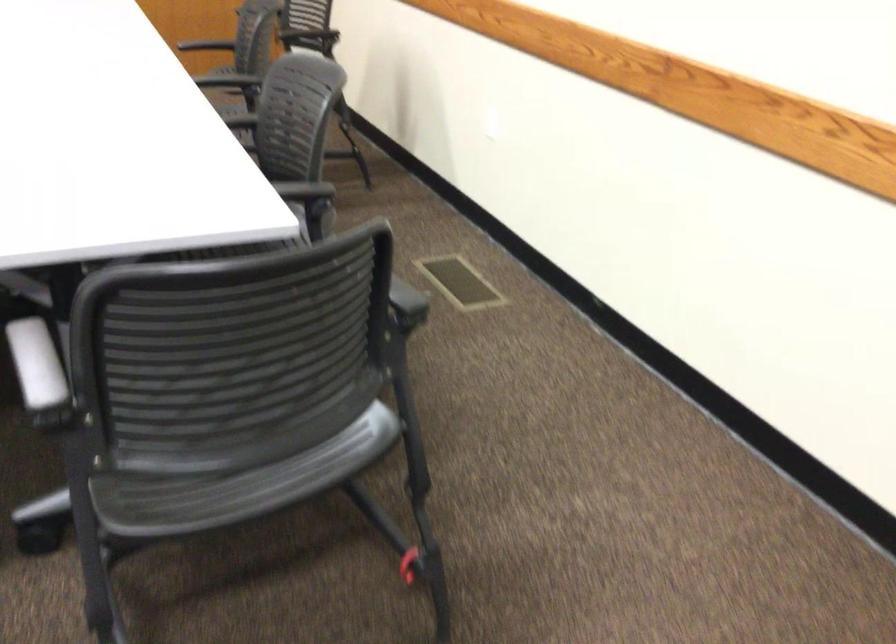
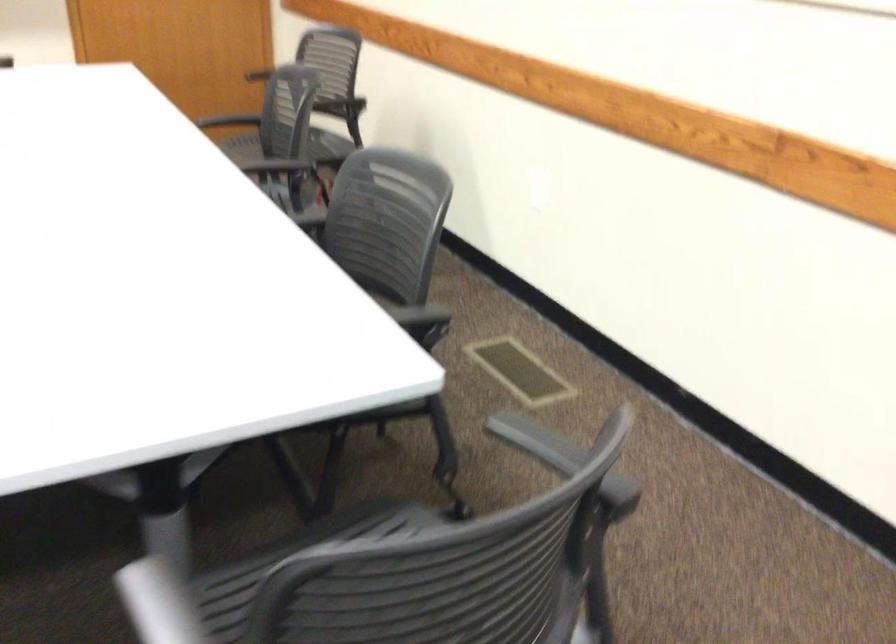
Find the pixel in the second image that matches [104,278] in the first image.

(293, 560)